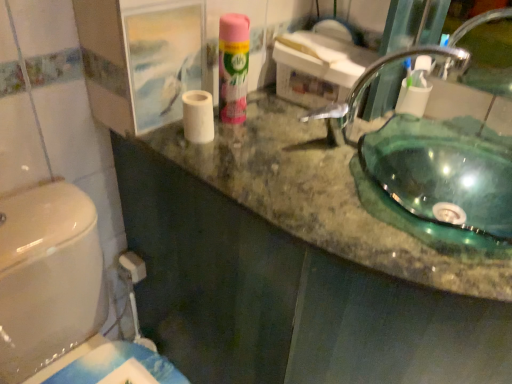
The image size is (512, 384). What are the coordinates of `unoccupied region to the right of transparent glass sink at upper right` in the screenshot? It's located at (465, 183).